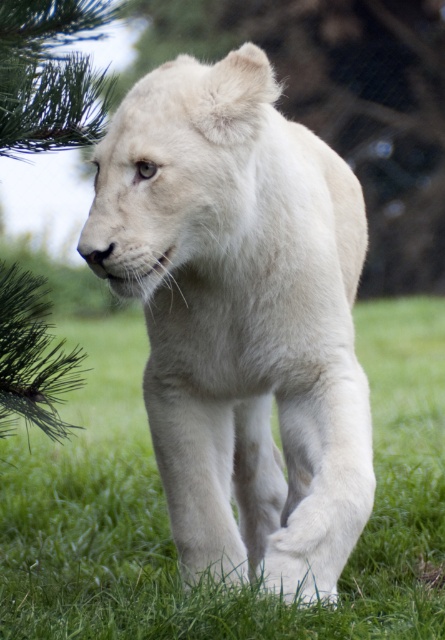
You are a wildlife photographer trying to capture a photo of the white fluffy lion at center. Your camera is set to focus at point (241, 316). Will the focus point hit the lion?

Result: The white fluffy lion at center is located at point (241, 316), so yes, the focus point will hit the lion.

From the picture: You are standing in a grassy area and see the white fluffy lion at center. If you want to maintain a safe distance of at least 3 meters from the lion, are you currently too close?

The white fluffy lion at center and viewer are 2.60 meters apart. Since the safe distance is 3 meters, you are currently too close to the white fluffy lion at center by 0.40 meters.

Based on the scene description, can you determine which object is taller between the white fluffy lion at center and the green soft grass at center?

The white fluffy lion at center is taller than the green soft grass at center according to the description.